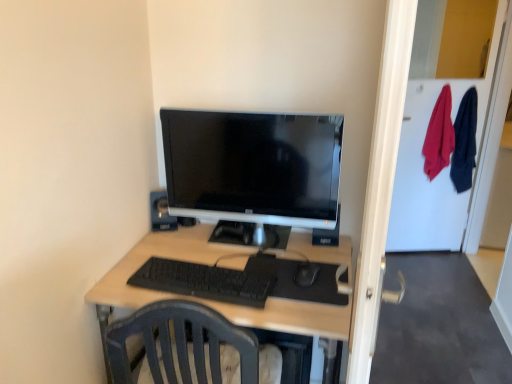
Identify the location of free space above light wood desk at center (from a real-world perspective). The height and width of the screenshot is (384, 512). (234, 263).